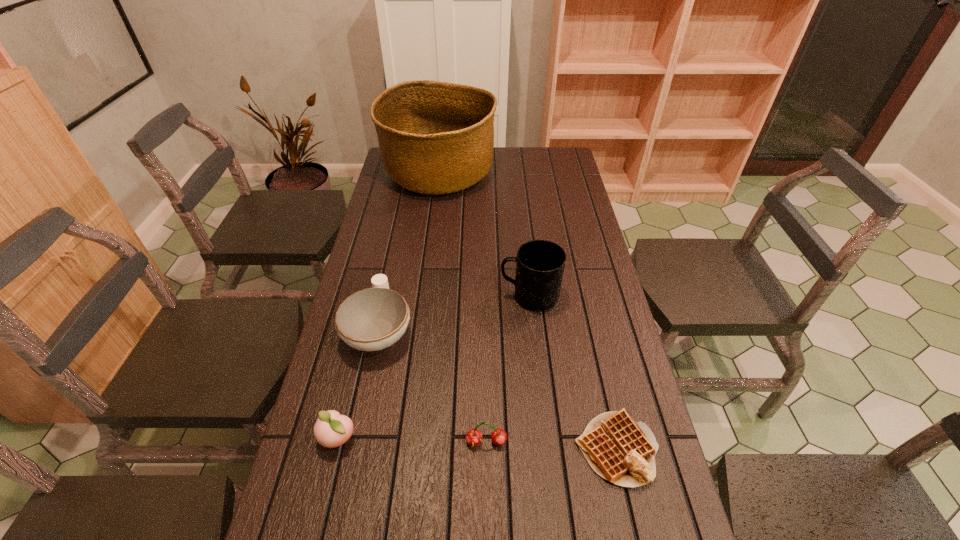
Identify the location of the tallest object. (435, 138).

Locate an element on the screen. The width and height of the screenshot is (960, 540). basket is located at coordinates (435, 138).

The width and height of the screenshot is (960, 540). I want to click on the fifth shortest object, so click(540, 264).

Identify the location of chinaware. (372, 319).

Image resolution: width=960 pixels, height=540 pixels. Identify the location of peach. (331, 429).

This screenshot has height=540, width=960. I want to click on cherry, so click(x=474, y=437).

At what (x,y) coordinates should I click in order to perform the action: click on waffle. Please return your answer as a coordinate pair (x, y). The width and height of the screenshot is (960, 540). Looking at the image, I should click on (620, 450).

Find the location of `free point located on the right of the tallest object`. free point located on the right of the tallest object is located at coordinates (517, 174).

Locate an element on the screen. The width and height of the screenshot is (960, 540). free space located 0.050m on the side of the fifth shortest object with the handle is located at coordinates (483, 296).

Where is `free spot located 0.370m on the side of the fifth shortest object with the handle`? Image resolution: width=960 pixels, height=540 pixels. free spot located 0.370m on the side of the fifth shortest object with the handle is located at coordinates coord(375,296).